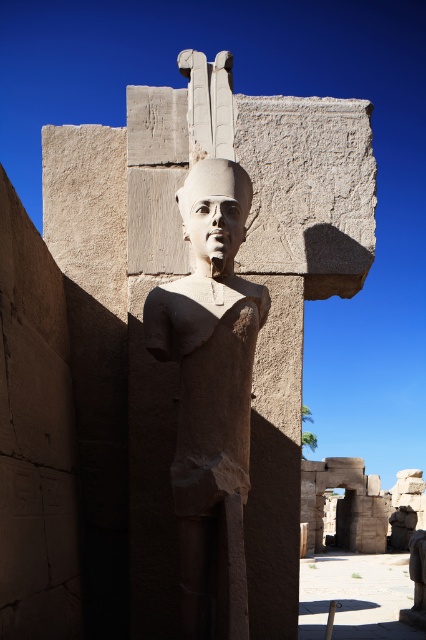
You are an archaeologist examining the ancient Egyptian statue. What are the coordinates of the smooth stone statue at center in the image?

The smooth stone statue at center is located at coordinates (x=247, y=278).

You are an archaeologist standing in front of the ancient Egyptian statue. You notice a smooth stone head at center and a smooth stone statue at center. Which one is closer to you?

The smooth stone head at center is closer to you since it is only 7.37 meters away from the smooth stone statue at center, but the question states both are at center, so their distance might be confusing. Wait, the description says the statue is at center and the head is also at center, but the distance between them is 7.37 meters. That seems contradictory. Maybe there is a mistake in the input?

You are an archaeologist examining the ancient Egyptian statue. You notice two parts of the statue labeled as the smooth stone statue at center and the smooth stone head at center. Which part has a greater width?

The smooth stone statue at center might be wider than smooth stone head at center according to the description.